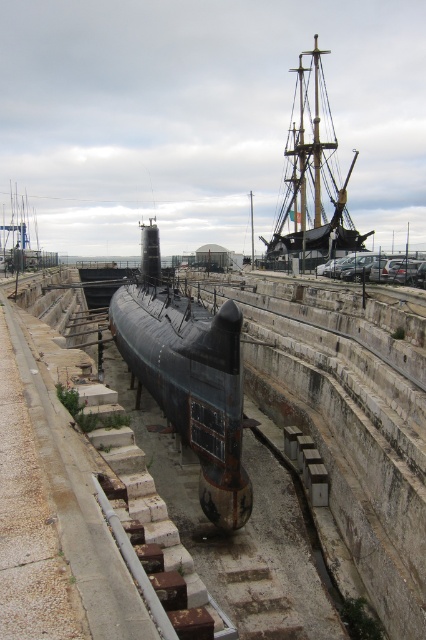
Does rusty metal submarine at center appear on the left side of rusty metal ship at upper right?

Correct, you'll find rusty metal submarine at center to the left of rusty metal ship at upper right.

Between rusty metal submarine at center and rusty metal ship at upper right, which one has less height?

rusty metal submarine at center is shorter.

Does point (238, 419) come in front of point (319, 189)?

Yes, it is.

You are a GUI agent. You are given a task and a screenshot of the screen. Output one action in this format:
    pyautogui.click(x=<x>, y=<y>)
    Task: Click on the rusty metal submarine at center
    The image size is (426, 640).
    Given the screenshot: What is the action you would take?
    pyautogui.click(x=189, y=378)